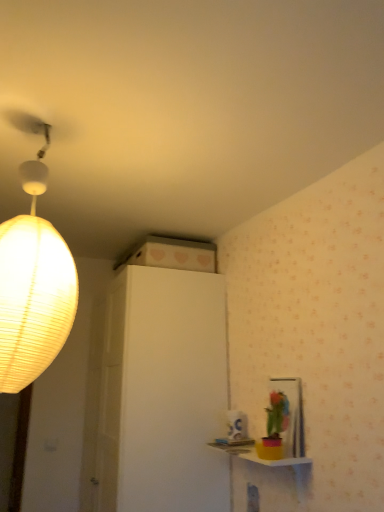
What do you see at coordinates (33, 281) in the screenshot? This screenshot has width=384, height=512. I see `matte paper lampshade at left` at bounding box center [33, 281].

Locate an element on the screen. The width and height of the screenshot is (384, 512). matte paper lampshade at left is located at coordinates (33, 281).

I want to click on yellow matte table at lower right, so click(x=262, y=477).

Describe the element at coordinates (262, 477) in the screenshot. Image resolution: width=384 pixels, height=512 pixels. I see `yellow matte table at lower right` at that location.

Identify the location of matte paper lampshade at left. This screenshot has height=512, width=384. (33, 281).

Can you confirm if yellow matte table at lower right is positioned to the right of matte paper lampshade at left?

Yes.

Is the position of yellow matte table at lower right less distant than that of matte paper lampshade at left?

No.

Is point (251, 502) closer to viewer compared to point (32, 277)?

No, it is not.

From the image's perspective, which one is positioned higher, yellow matte table at lower right or matte paper lampshade at left?

matte paper lampshade at left.

Consider the image. From a real-world perspective, between yellow matte table at lower right and matte paper lampshade at left, who is vertically higher?

matte paper lampshade at left is physically above.

Which of these two, yellow matte table at lower right or matte paper lampshade at left, is wider?

With larger width is matte paper lampshade at left.

Is yellow matte table at lower right taller than matte paper lampshade at left?

In fact, yellow matte table at lower right may be shorter than matte paper lampshade at left.

Which of these two, yellow matte table at lower right or matte paper lampshade at left, is smaller?

yellow matte table at lower right.

Would you say yellow matte table at lower right is inside or outside matte paper lampshade at left?

yellow matte table at lower right is not inside matte paper lampshade at left, it's outside.

Is yellow matte table at lower right far from matte paper lampshade at left?

yellow matte table at lower right is far away from matte paper lampshade at left.

Is yellow matte table at lower right turned away from matte paper lampshade at left?

No, yellow matte table at lower right is not facing away from matte paper lampshade at left.

Locate an element on the screen. table directly beneath the matte paper lampshade at left (from a real-world perspective) is located at coordinates (262, 477).

Which is more to the left, matte paper lampshade at left or yellow matte table at lower right?

Positioned to the left is matte paper lampshade at left.

Who is more distant, matte paper lampshade at left or yellow matte table at lower right?

yellow matte table at lower right is further from the camera.

Does point (27, 242) come in front of point (272, 461)?

Yes, it is.

From the image's perspective, which is below, matte paper lampshade at left or yellow matte table at lower right?

From the image's view, yellow matte table at lower right is below.

From a real-world perspective, is matte paper lampshade at left positioned above or below yellow matte table at lower right?

matte paper lampshade at left is above yellow matte table at lower right.

Can you confirm if matte paper lampshade at left is thinner than yellow matte table at lower right?

In fact, matte paper lampshade at left might be wider than yellow matte table at lower right.

Between matte paper lampshade at left and yellow matte table at lower right, which one has more height?

matte paper lampshade at left is taller.

Looking at this image, between matte paper lampshade at left and yellow matte table at lower right, which one has larger size?

matte paper lampshade at left.

Is yellow matte table at lower right inside matte paper lampshade at left?

No, yellow matte table at lower right is not inside matte paper lampshade at left.

Is matte paper lampshade at left with yellow matte table at lower right?

matte paper lampshade at left and yellow matte table at lower right are not in contact.

Is matte paper lampshade at left oriented towards yellow matte table at lower right?

No, matte paper lampshade at left does not turn towards yellow matte table at lower right.

How much distance is there between matte paper lampshade at left and yellow matte table at lower right?

1.21 meters.

Where is `table below the matte paper lampshade at left (from a real-world perspective)`? table below the matte paper lampshade at left (from a real-world perspective) is located at coordinates (262, 477).

The image size is (384, 512). I want to click on table behind the matte paper lampshade at left, so click(x=262, y=477).

In order to click on table below the matte paper lampshade at left (from a real-world perspective) in this screenshot , I will do `click(262, 477)`.